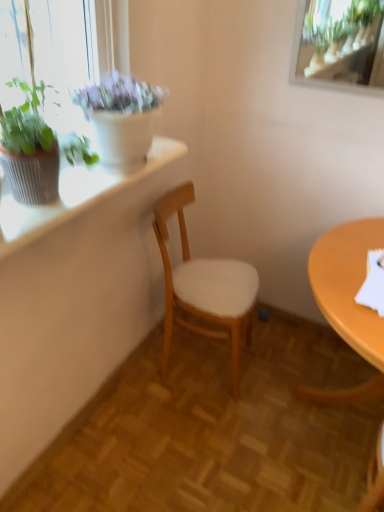
The width and height of the screenshot is (384, 512). In order to click on vacant space underneath textured white window sill at upper left (from a real-world perspective) in this screenshot , I will do `click(112, 416)`.